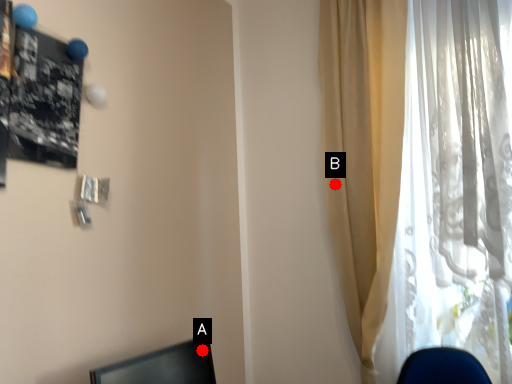
Question: Two points are circled on the image, labeled by A and B beside each circle. Among these points, which one is farthest from the camera?

Choices:
 (A) A is further
 (B) B is further

Answer: (B)